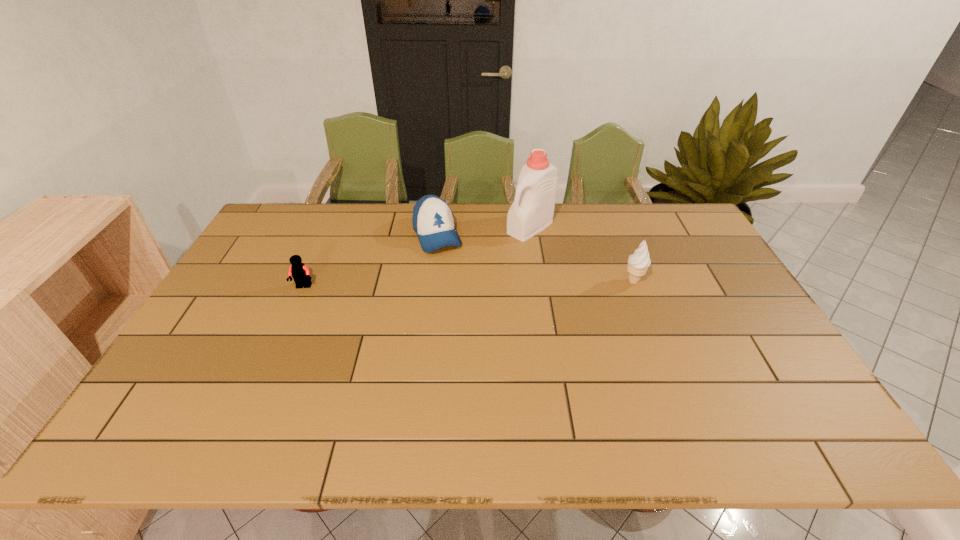
Where is `vacant space on the desktop that is between the Lego and the rightmost object and is positioned on the handle side of the tallest object`? The image size is (960, 540). vacant space on the desktop that is between the Lego and the rightmost object and is positioned on the handle side of the tallest object is located at coordinates 446,285.

Where is `free space on the desktop that is between the Lego and the rightmost object and is positioned on the front-facing side of the second object from left to right`? The height and width of the screenshot is (540, 960). free space on the desktop that is between the Lego and the rightmost object and is positioned on the front-facing side of the second object from left to right is located at coordinates [x=462, y=284].